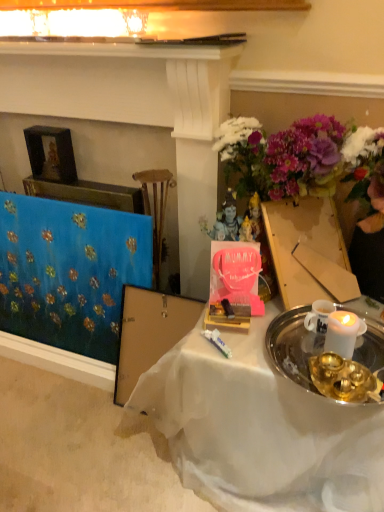
Question: Can you confirm if blue fabric at left is taller than blue fabric at left?

Choices:
 (A) no
 (B) yes

Answer: (B)

Question: Would you consider blue fabric at left to be distant from blue fabric at left?

Choices:
 (A) no
 (B) yes

Answer: (A)

Question: Is blue fabric at left bigger than blue fabric at left?

Choices:
 (A) yes
 (B) no

Answer: (A)

Question: Considering the relative positions of blue fabric at left and blue fabric at left in the image provided, is blue fabric at left in front of blue fabric at left?

Choices:
 (A) no
 (B) yes

Answer: (B)

Question: Does blue fabric at left have a lesser width compared to blue fabric at left?

Choices:
 (A) yes
 (B) no

Answer: (B)

Question: From a real-world perspective, is blue fabric at left on blue fabric at left?

Choices:
 (A) yes
 (B) no

Answer: (A)

Question: From a real-world perspective, is blue fabric at left on blue fabric at left?

Choices:
 (A) yes
 (B) no

Answer: (B)

Question: Is blue fabric at left surrounding blue fabric at left?

Choices:
 (A) yes
 (B) no

Answer: (B)

Question: Is blue fabric at left smaller than blue fabric at left?

Choices:
 (A) no
 (B) yes

Answer: (B)

Question: Does blue fabric at left have a greater width compared to blue fabric at left?

Choices:
 (A) yes
 (B) no

Answer: (B)

Question: From a real-world perspective, is blue fabric at left physically below blue fabric at left?

Choices:
 (A) no
 (B) yes

Answer: (B)

Question: Is blue fabric at left at the back of blue fabric at left?

Choices:
 (A) no
 (B) yes

Answer: (B)

Question: Is the surface of blue fabric at left in direct contact with white sheer cloth at center?

Choices:
 (A) yes
 (B) no

Answer: (B)